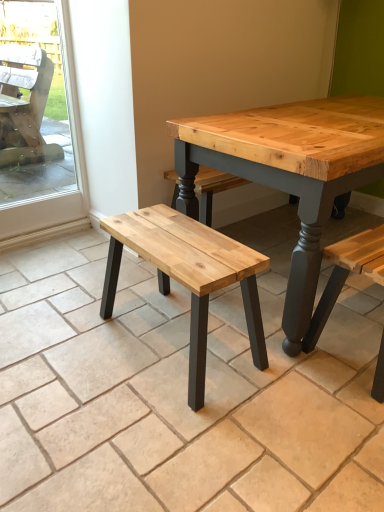
Question: Can you confirm if natural wood bench at center is shorter than natural wood bench at center?

Choices:
 (A) no
 (B) yes

Answer: (B)

Question: Is the depth of natural wood bench at center less than that of natural wood bench at center?

Choices:
 (A) yes
 (B) no

Answer: (A)

Question: Considering the relative sizes of natural wood bench at center and natural wood bench at center in the image provided, is natural wood bench at center thinner than natural wood bench at center?

Choices:
 (A) yes
 (B) no

Answer: (B)

Question: Does natural wood bench at center appear on the right side of natural wood bench at center?

Choices:
 (A) no
 (B) yes

Answer: (B)

Question: Does natural wood bench at center have a larger size compared to natural wood bench at center?

Choices:
 (A) no
 (B) yes

Answer: (B)

Question: Is natural wood bench at center bigger or smaller than transparent glass screen door at left?

Choices:
 (A) small
 (B) big

Answer: (B)

Question: In terms of width, does natural wood bench at center look wider or thinner when compared to transparent glass screen door at left?

Choices:
 (A) thin
 (B) wide

Answer: (B)

Question: Would you say natural wood bench at center is to the left or to the right of transparent glass screen door at left in the picture?

Choices:
 (A) left
 (B) right

Answer: (B)

Question: From the image's perspective, relative to transparent glass screen door at left, is natural wood bench at center above or below?

Choices:
 (A) below
 (B) above

Answer: (A)

Question: From their relative heights in the image, would you say natural wood bench at center is taller or shorter than natural wood bench at center?

Choices:
 (A) short
 (B) tall

Answer: (A)

Question: Considering the positions of natural wood bench at center and natural wood bench at center in the image, is natural wood bench at center bigger or smaller than natural wood bench at center?

Choices:
 (A) small
 (B) big

Answer: (B)

Question: Considering the positions of point (140, 500) and point (190, 241), is point (140, 500) closer or farther from the camera than point (190, 241)?

Choices:
 (A) closer
 (B) farther

Answer: (A)

Question: Considering the positions of natural wood bench at center and natural wood bench at center in the image, is natural wood bench at center wider or thinner than natural wood bench at center?

Choices:
 (A) thin
 (B) wide

Answer: (B)

Question: Considering their positions, is transparent glass screen door at left located in front of or behind natural wood bench at center?

Choices:
 (A) front
 (B) behind

Answer: (B)

Question: In terms of size, does transparent glass screen door at left appear bigger or smaller than natural wood bench at center?

Choices:
 (A) big
 (B) small

Answer: (B)